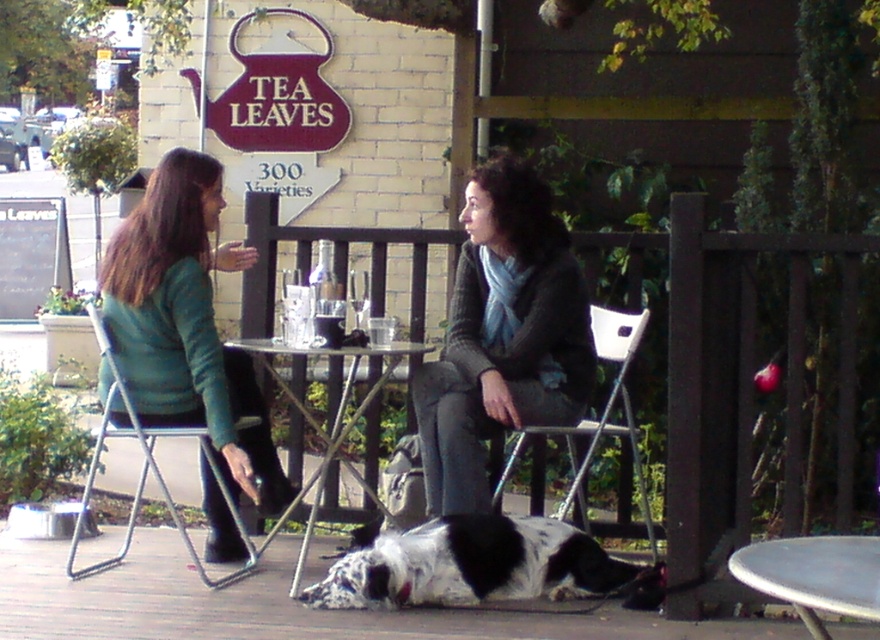
Question: Is the position of black and white spotted dog at lower center less distant than that of white plastic chair at center?

Choices:
 (A) yes
 (B) no

Answer: (A)

Question: Is black and white spotted dog at lower center above metallic silver chair at left?

Choices:
 (A) yes
 (B) no

Answer: (B)

Question: Which of the following is the farthest from the observer?

Choices:
 (A) metallic silver table at center
 (B) teal sweater at left

Answer: (B)

Question: Which point appears farthest from the camera in this image?

Choices:
 (A) (118, 560)
 (B) (213, 522)
 (C) (537, 234)

Answer: (B)

Question: Can you confirm if white plastic chair at center is positioned below metallic silver chair at left?

Choices:
 (A) yes
 (B) no

Answer: (B)

Question: Which is farther from the metallic silver table at lower right?

Choices:
 (A) metallic silver table at center
 (B) teal sweater at left
 (C) knitted gray sweater at center

Answer: (B)